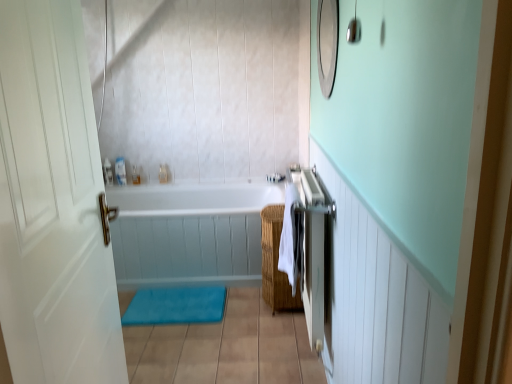
Question: From the image's perspective, relative to white glossy bathtub at center, is clear plastic bottle at upper left, placed as the third toiletry when sorted from right to left, above or below?

Choices:
 (A) below
 (B) above

Answer: (B)

Question: From a real-world perspective, relative to white glossy bathtub at center, is clear plastic bottle at upper left, placed as the third toiletry when sorted from right to left, vertically above or below?

Choices:
 (A) above
 (B) below

Answer: (A)

Question: Which is farther from the blue fabric bath mat at lower center?

Choices:
 (A) translucent plastic soap dispenser at upper center, marked as the 2th toiletry in a left-to-right arrangement
 (B) white glossy bathtub at center
 (C) white matte door at left
 (D) clear plastic bottle at upper left, placed as the third toiletry when sorted from right to left
 (E) translucent plastic container at upper center, which ranks as the 3th toiletry in left-to-right order

Answer: (C)

Question: Estimate the real-world distances between objects in this image. Which object is closer to the white cotton beach towel at right?

Choices:
 (A) white glossy bathtub at center
 (B) translucent plastic soap dispenser at upper center, which ranks as the second toiletry in right-to-left order
 (C) translucent plastic container at upper center, which ranks as the 3th toiletry in left-to-right order
 (D) white matte door at left
 (E) woven brown basket at center

Answer: (E)